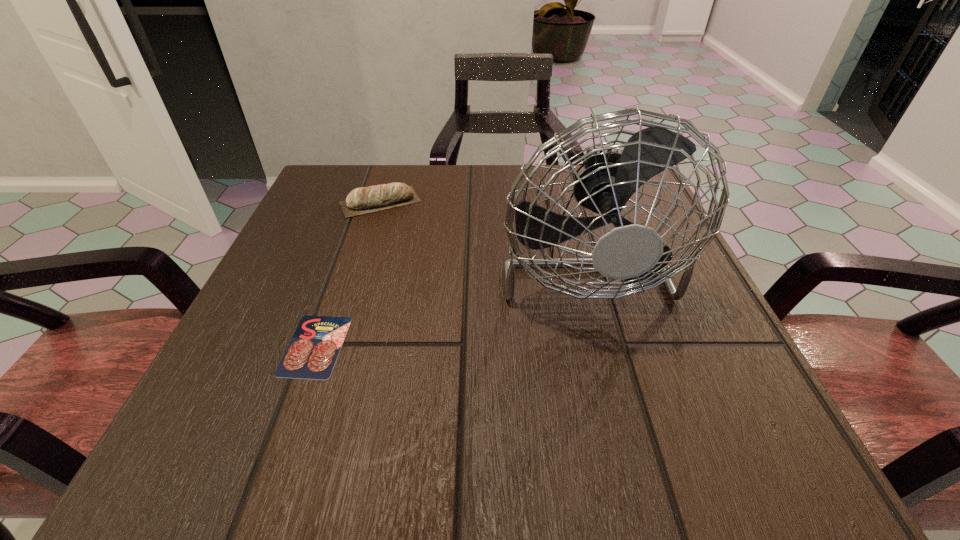
I want to click on salami at the left edge, so click(312, 352).

I want to click on object located in the right edge section of the desktop, so click(630, 252).

Identify the location of object at the far left corner. This screenshot has height=540, width=960. [x=363, y=200].

This screenshot has height=540, width=960. I want to click on object at the far right corner, so click(x=630, y=252).

Locate an element on the screen. The height and width of the screenshot is (540, 960). vacant space at the far edge of the desktop is located at coordinates (481, 179).

In the image, there is a desktop. Where is `free space at the near edge`? free space at the near edge is located at coordinates (417, 437).

This screenshot has height=540, width=960. I want to click on vacant space at the left edge, so [305, 224].

In order to click on free space at the far left corner in this screenshot , I will do `click(350, 178)`.

The width and height of the screenshot is (960, 540). I want to click on blank space at the near left corner of the desktop, so click(280, 405).

Find the location of a particular element. This screenshot has height=540, width=960. vacant space at the near right corner of the desktop is located at coordinates (708, 420).